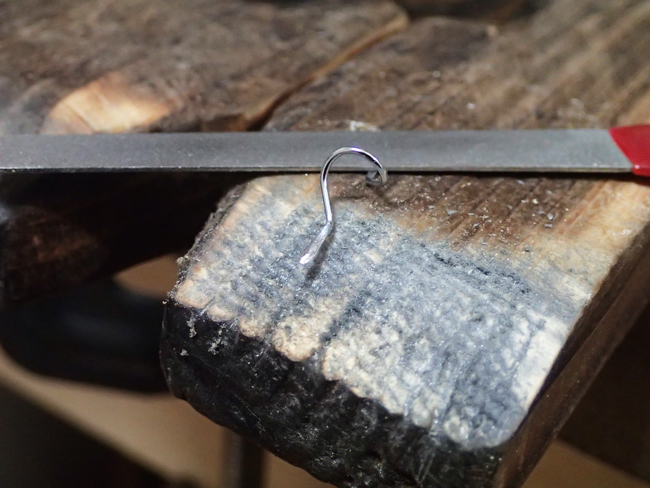
You are a GUI agent. You are given a task and a screenshot of the screen. Output one action in this format:
    pyautogui.click(x=<x>, y=<y>)
    Task: Click on the cut up board
    The height and width of the screenshot is (488, 650).
    Given the screenshot: What is the action you would take?
    pyautogui.click(x=133, y=114), pyautogui.click(x=82, y=96)